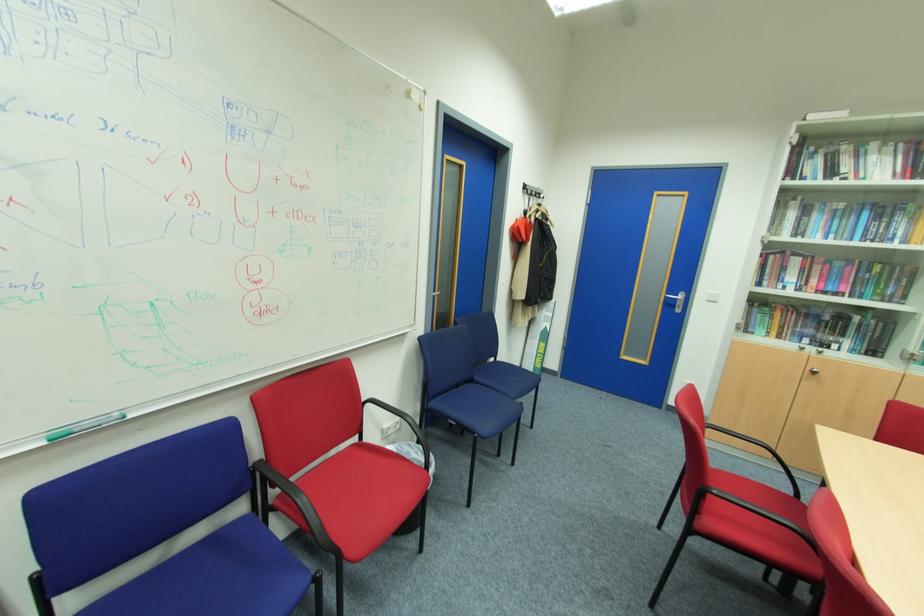
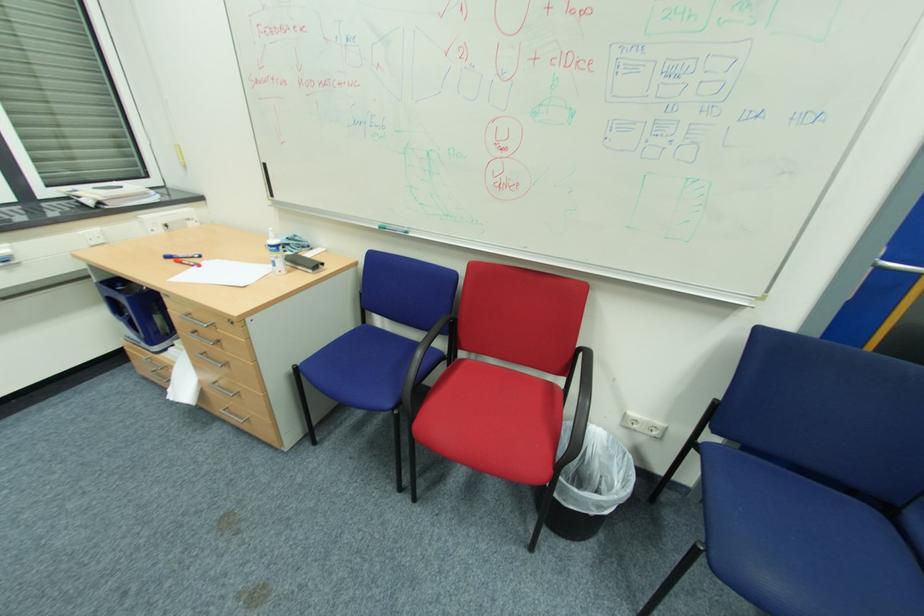
Based on the continuous images, in which direction is the camera rotating?

The camera's rotation is toward left-down.